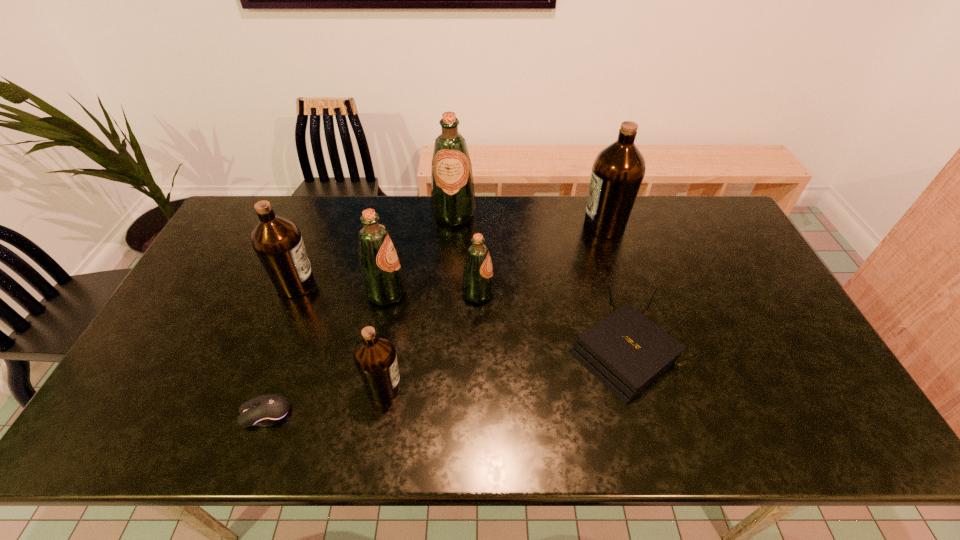
Identify which olive oil is located as the fourth nearest to the smallest brown olive oil. Please provide its 2D coordinates. Your answer should be formatted as a tuple, i.e. [(x, y)], where the tuple contains the x and y coordinates of a point satisfying the conditions above.

[(453, 203)]

Locate an element on the screen. The width and height of the screenshot is (960, 540). brown olive oil object that ranks as the closest to the smallest green olive oil is located at coordinates (375, 358).

Locate an element on the screen. The height and width of the screenshot is (540, 960). brown olive oil object that ranks as the second closest to the smallest green olive oil is located at coordinates [618, 170].

The width and height of the screenshot is (960, 540). I want to click on green olive oil that stands as the closest to the smallest green olive oil, so click(382, 277).

Select which green olive oil is the second closest to the nearest olive oil. Please provide its 2D coordinates. Your answer should be formatted as a tuple, i.e. [(x, y)], where the tuple contains the x and y coordinates of a point satisfying the conditions above.

[(478, 284)]

Where is `free spot that satisfies the following two spatial constraints: 1. on the front-facing side of the leftmost green olive oil; 2. on the front side of the black computer mouse`? The width and height of the screenshot is (960, 540). free spot that satisfies the following two spatial constraints: 1. on the front-facing side of the leftmost green olive oil; 2. on the front side of the black computer mouse is located at coordinates 362,413.

The width and height of the screenshot is (960, 540). Find the location of `free space that satisfies the following two spatial constraints: 1. on the front-facing side of the second biggest green olive oil; 2. on the left side of the black router`. free space that satisfies the following two spatial constraints: 1. on the front-facing side of the second biggest green olive oil; 2. on the left side of the black router is located at coordinates (374, 353).

Where is `vacant space that satisfies the following two spatial constraints: 1. on the front-facing side of the second smallest green olive oil; 2. on the left side of the router`? The height and width of the screenshot is (540, 960). vacant space that satisfies the following two spatial constraints: 1. on the front-facing side of the second smallest green olive oil; 2. on the left side of the router is located at coordinates (374, 353).

The width and height of the screenshot is (960, 540). What are the coordinates of `free space that satisfies the following two spatial constraints: 1. on the front-facing side of the biggest green olive oil; 2. on the front-facing side of the leftmost green olive oil` in the screenshot? It's located at (449, 293).

In order to click on vacant space that satisfies the following two spatial constraints: 1. on the front-facing side of the biggest green olive oil; 2. on the front-facing side of the leftmost green olive oil in this screenshot , I will do `click(449, 293)`.